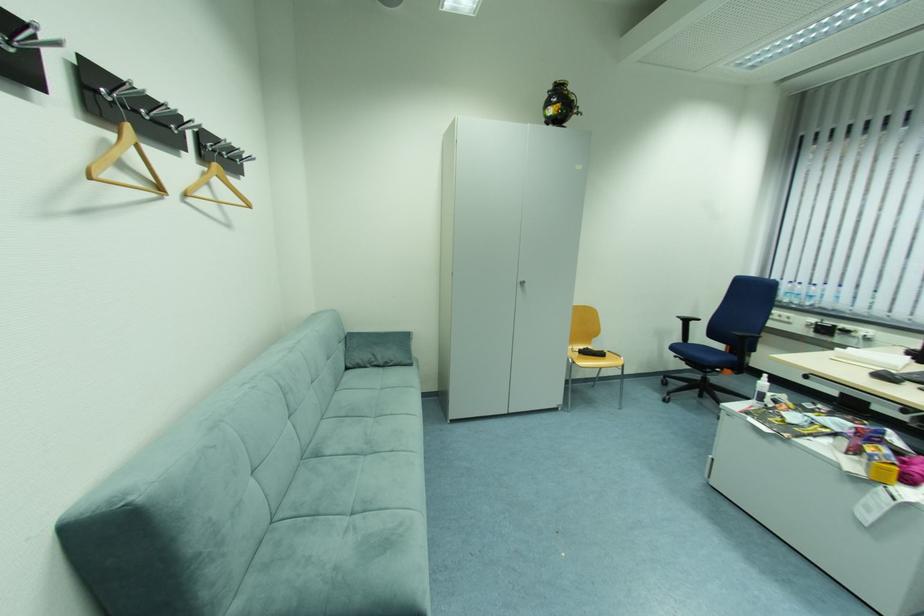
Describe the element at coordinates (706, 355) in the screenshot. The image size is (924, 616). I see `the blue chair sitting surface` at that location.